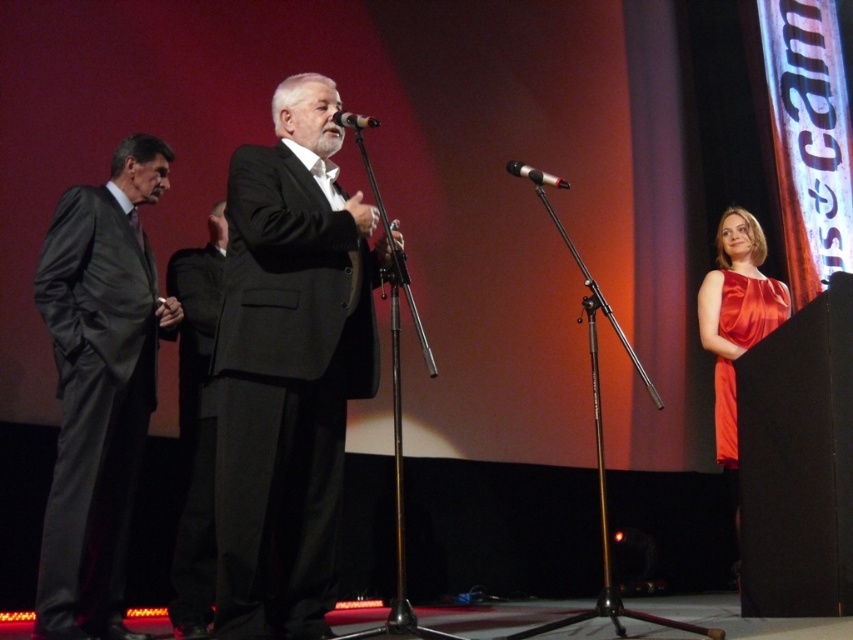
Who is positioned more to the left, satin dress at right or black metallic microphone at center?

Positioned to the left is black metallic microphone at center.

Measure the distance between satin dress at right and camera.

They are 3.58 meters apart.

This screenshot has width=853, height=640. What do you see at coordinates (735, 321) in the screenshot? I see `satin dress at right` at bounding box center [735, 321].

Where is `satin dress at right`? The image size is (853, 640). satin dress at right is located at coordinates (735, 321).

Measure the distance between point (239,602) and camera.

Point (239,602) and camera are 8.63 feet apart from each other.

Is matte black suit at center smaller than matte gray suit at left?

Correct, matte black suit at center occupies less space than matte gray suit at left.

Image resolution: width=853 pixels, height=640 pixels. What are the coordinates of `matte black suit at center` in the screenshot? It's located at (288, 368).

The image size is (853, 640). Describe the element at coordinates (97, 387) in the screenshot. I see `matte gray suit at left` at that location.

This screenshot has height=640, width=853. I want to click on matte gray suit at left, so click(x=97, y=387).